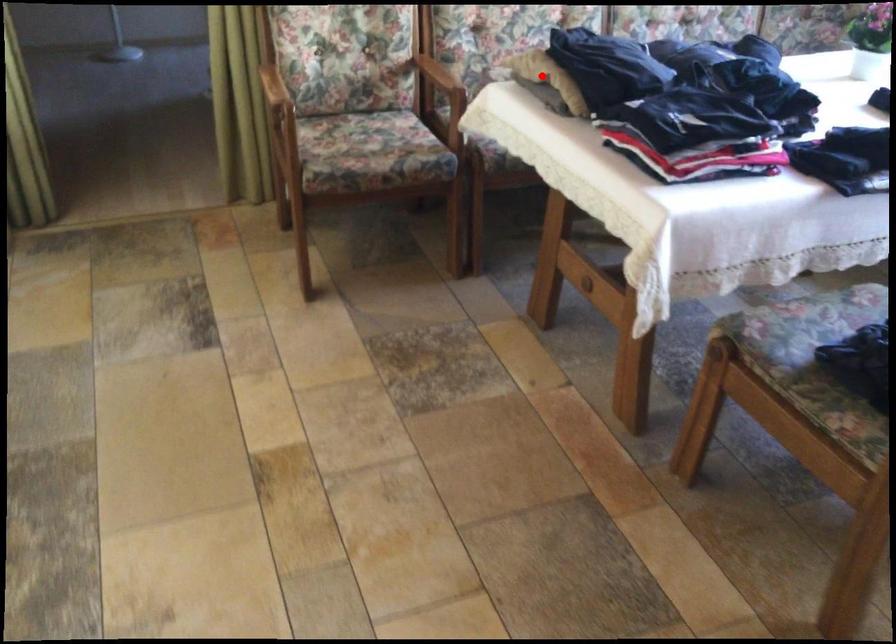
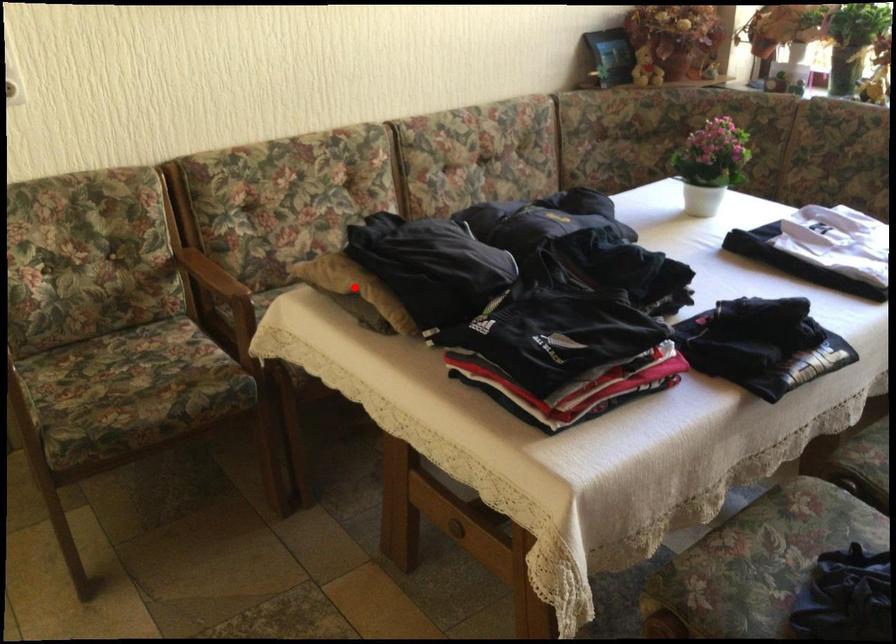
I am providing you with two images of the same scene from different viewpoints. A red point is marked on the first image and another point is marked on the second image. Are the points marked in image1 and image2 representing the same 3D position?

Yes